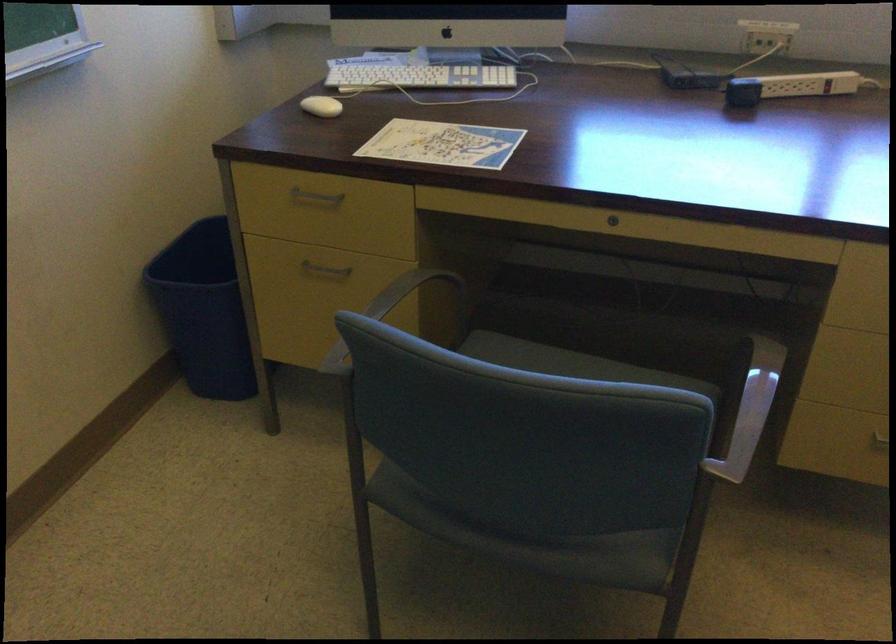
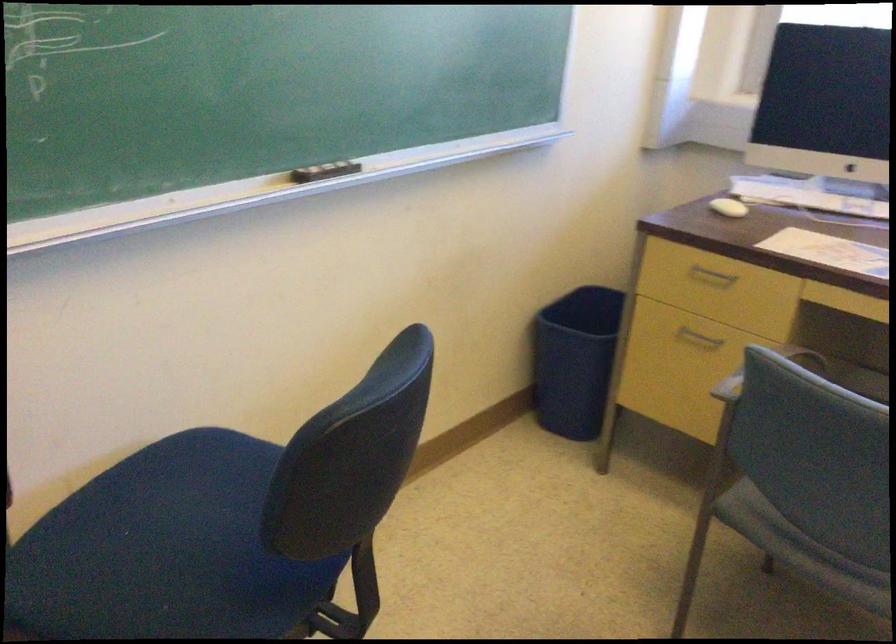
Question: I am providing you with two images of the same scene from different viewpoints. Please identify which objects are invisible in image2.

Choices:
 (A) grey chair sitting surface
 (B) metal drawer handle
 (C) office chair sitting surface
 (D) chair armrest

Answer: (D)